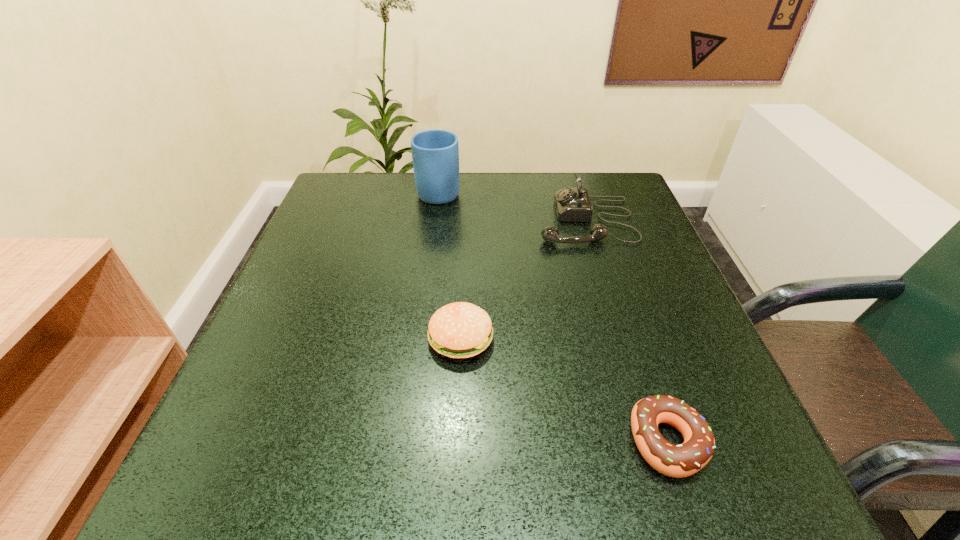
Locate an element on the screen. The image size is (960, 540). mug present at the far edge is located at coordinates (435, 153).

Find the location of a particular element. The height and width of the screenshot is (540, 960). telephone located in the far edge section of the desktop is located at coordinates (572, 204).

Where is `object located in the near edge section of the desktop`? object located in the near edge section of the desktop is located at coordinates (683, 460).

Identify the location of telephone at the right edge. The height and width of the screenshot is (540, 960). (572, 204).

The image size is (960, 540). Find the location of `doughnut located at the right edge`. doughnut located at the right edge is located at coordinates (683, 460).

Where is `object that is at the far right corner`? The image size is (960, 540). object that is at the far right corner is located at coordinates (572, 204).

This screenshot has height=540, width=960. In order to click on object positioned at the near right corner in this screenshot , I will do `click(683, 460)`.

In the image, there is a desktop. In order to click on vacant space at the far edge in this screenshot , I will do `click(499, 225)`.

I want to click on vacant space at the near edge of the desktop, so click(x=608, y=494).

The width and height of the screenshot is (960, 540). In the image, there is a desktop. What are the coordinates of `free space at the left edge` in the screenshot? It's located at (310, 232).